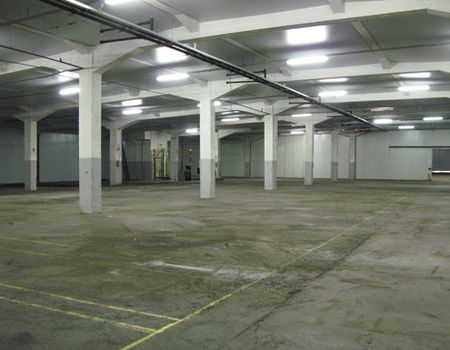
At what (x,y) coordinates should I click in order to perform the action: click on doorway. Please return your answer as a coordinate pair (x, y). The image size is (450, 350). Looking at the image, I should click on click(165, 159).